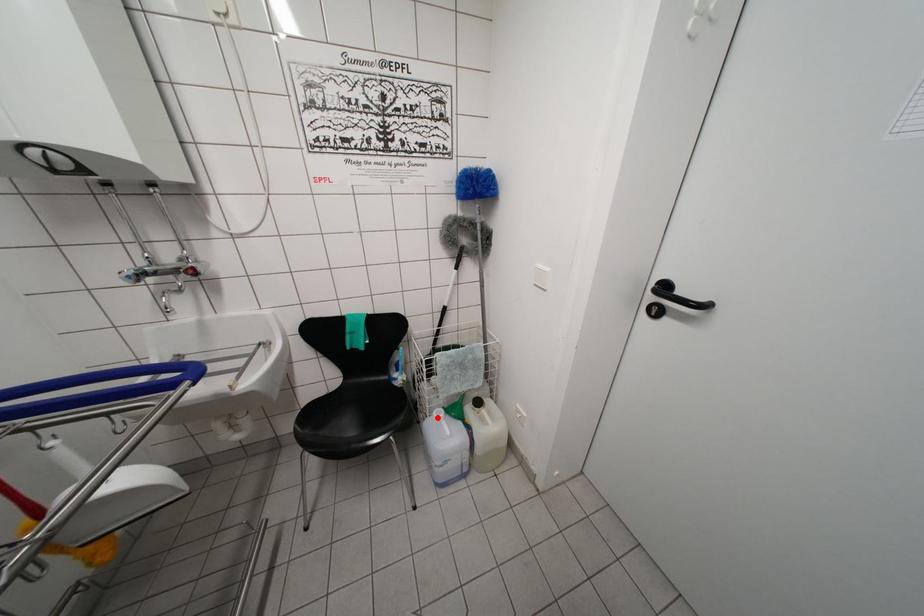
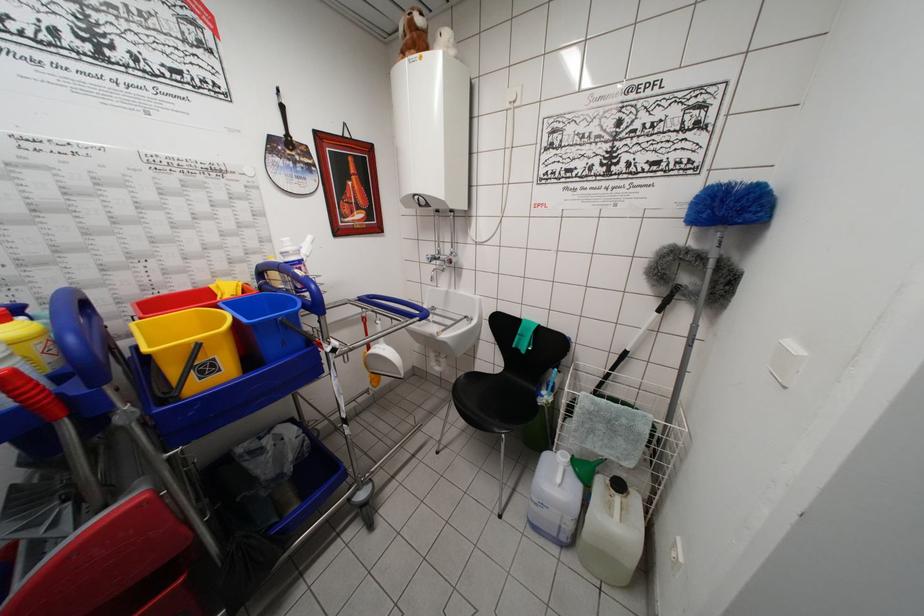
The point at the highlighted location is marked in the first image. Where is the corresponding point in the second image?

(563, 456)